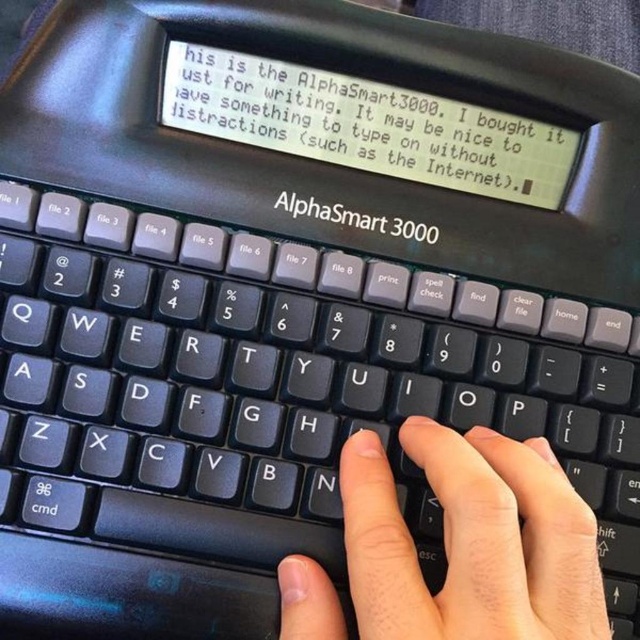
Question: Is black plastic keyboard at center smaller than skinny white hand at center?

Choices:
 (A) no
 (B) yes

Answer: (A)

Question: Does black plastic keyboard at center appear over skinny white hand at center?

Choices:
 (A) no
 (B) yes

Answer: (B)

Question: Is black plastic keyboard at center wider than skinny white hand at center?

Choices:
 (A) no
 (B) yes

Answer: (B)

Question: Which object is farther from the camera taking this photo?

Choices:
 (A) black plastic keyboard at center
 (B) skinny white hand at center

Answer: (A)